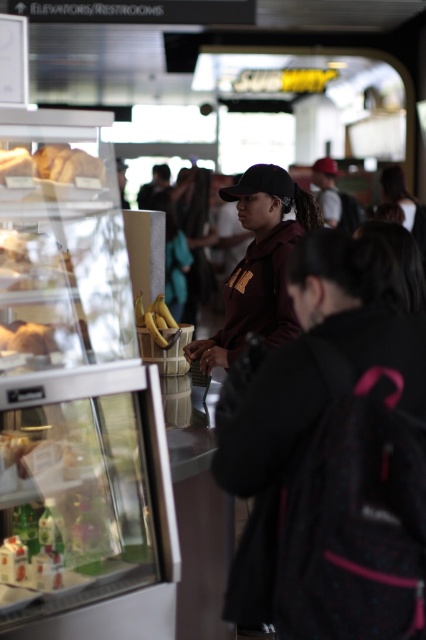
You are a customer at Subway and want to order a sandwich. You see the matte brown bread at upper left and the maroon fabric shirt at center. Which object is positioned to the right of the other?

The maroon fabric shirt at center is to the right of the matte brown bread at upper left.

You are a customer at the Subway sandwich shop and want to order a sandwich. You see the maroon hoodie at center and the black matte baseball cap at center. Which one is closer to the counter where you are standing?

The maroon hoodie at center is located below the black matte baseball cap at center, so the maroon hoodie at center is closer to the counter where you are standing.

You are a customer at Subway and want to order a sandwich. You see the maroon fabric shirt at center and the black matte baseball cap at center. Which employee should you approach to place your order?

The employee wearing the maroon fabric shirt at center is positioned on the right side of the black matte baseball cap at center, so you should approach the employee with the maroon fabric shirt at center since they are closer to the counter where orders are taken.